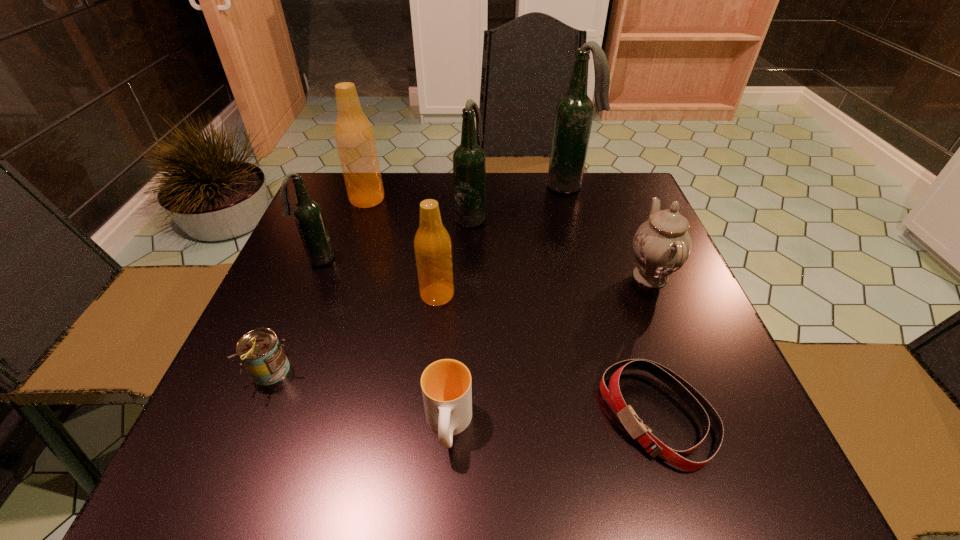
You are a GUI agent. You are given a task and a screenshot of the screen. Output one action in this format:
    pyautogui.click(x=<x>, y=<y>)
    Task: Click on the free spot that satisfies the following two spatial constraints: 1. on the back side of the leftmost dark beer bottle; 2. on the right side of the rightmost dark beer bottle
    The height and width of the screenshot is (540, 960).
    Given the screenshot: What is the action you would take?
    pyautogui.click(x=349, y=186)

The height and width of the screenshot is (540, 960). Identify the location of vacant point that satisfies the following two spatial constraints: 1. on the back side of the second dark beer bottle from left to right; 2. on the right side of the nearest beer bottle. (444, 217).

Locate an element on the screen. Image resolution: width=960 pixels, height=540 pixels. free spot that satisfies the following two spatial constraints: 1. on the back side of the second dark beer bottle from right to left; 2. on the left side of the second nearest beer bottle is located at coordinates (337, 217).